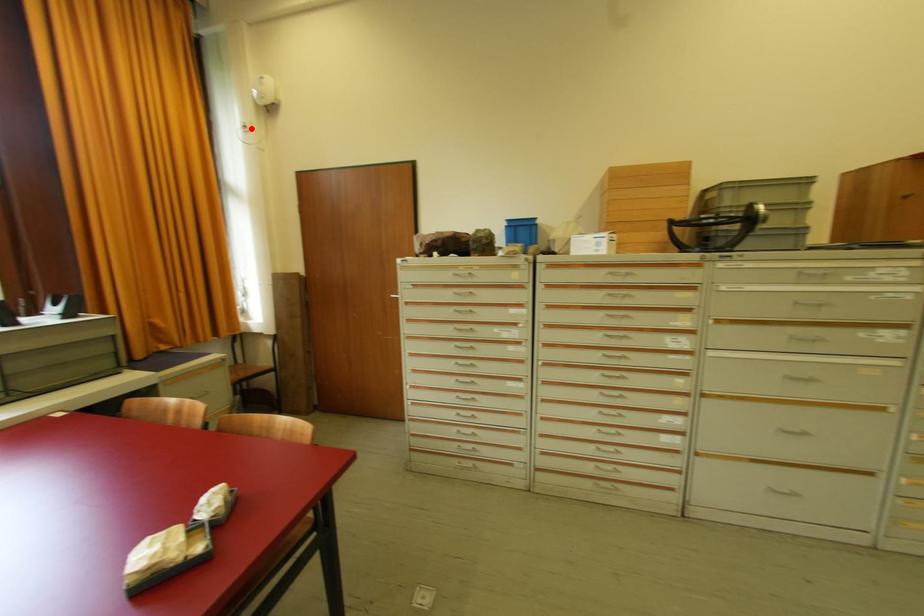
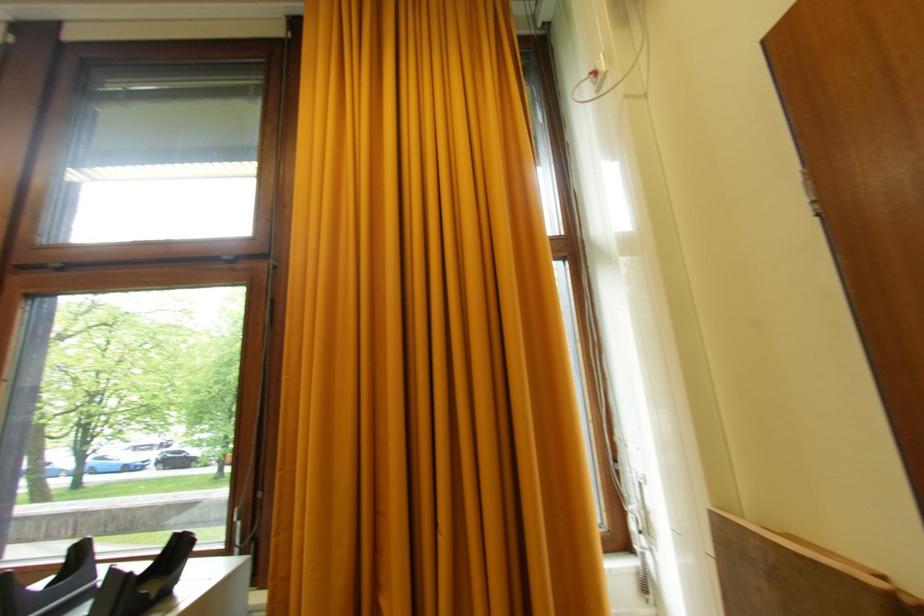
In the second image, find the point that corresponds to the highlighted location in the first image.

(604, 69)